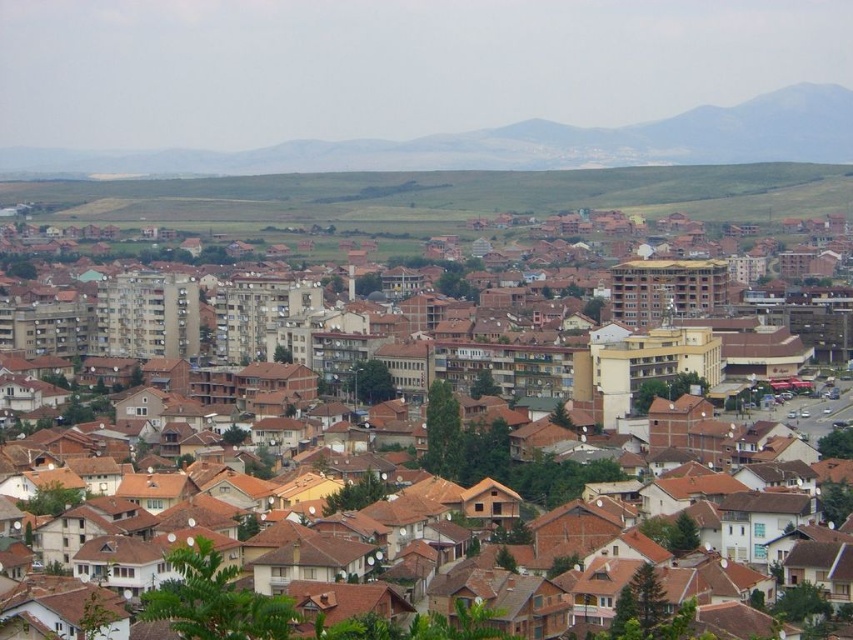
Is brown brick buildings at center thinner than green grassland at center?

Correct, brown brick buildings at center's width is less than green grassland at center's.

Is point (775, 340) closer to viewer compared to point (688, 172)?

That is True.

Where is `brown brick buildings at center`? brown brick buildings at center is located at coordinates (457, 404).